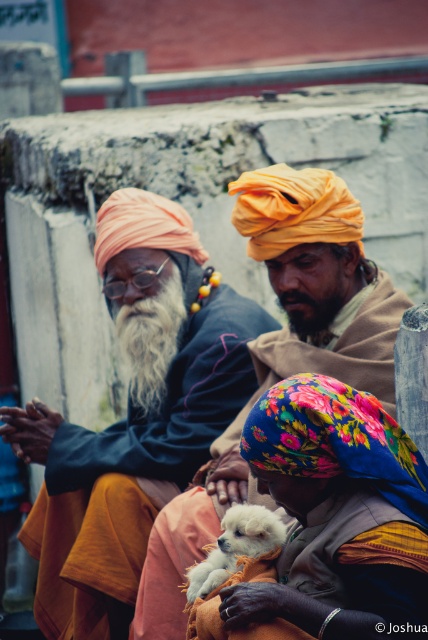
Which is above, matte orange turban at left or white fluffy dog at center?

matte orange turban at left is above.

Who is lower down, matte orange turban at left or white fluffy dog at center?

white fluffy dog at center

Which is behind, point (166, 317) or point (272, 522)?

The point (166, 317) is more distant.

You are a GUI agent. You are given a task and a screenshot of the screen. Output one action in this format:
    pyautogui.click(x=<x>, y=<y>)
    Task: Click on the matte orange turban at left
    
    Given the screenshot: What is the action you would take?
    [x=133, y=417]

Between matte orange turban at left and gray matte beard at center, which one appears on the left side from the viewer's perspective?

matte orange turban at left is more to the left.

Who is shorter, matte orange turban at left or gray matte beard at center?

gray matte beard at center

Locate an element on the screen. matte orange turban at left is located at coordinates (133, 417).

Find the location of a particular element. The height and width of the screenshot is (640, 428). matte orange turban at left is located at coordinates (133, 417).

Can you confirm if matte orange turban at left is bigger than orange turbaned man at center?

No, matte orange turban at left is not bigger than orange turbaned man at center.

In the scene shown: How distant is matte orange turban at left from orange turbaned man at center?

matte orange turban at left is 13.53 feet away from orange turbaned man at center.

Between point (139, 244) and point (163, 580), which one is positioned in front?

Point (163, 580)

Locate an element on the screen. This screenshot has width=428, height=640. matte orange turban at left is located at coordinates (133, 417).